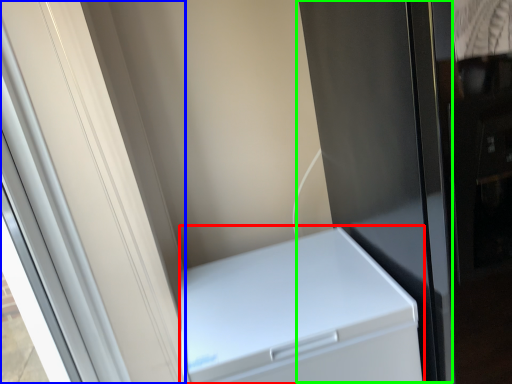
Question: Which object is the closest to the home appliance (highlighted by a red box)? Choose among these: screen door (highlighted by a blue box) or screen door (highlighted by a green box).

Choices:
 (A) screen door
 (B) screen door

Answer: (B)